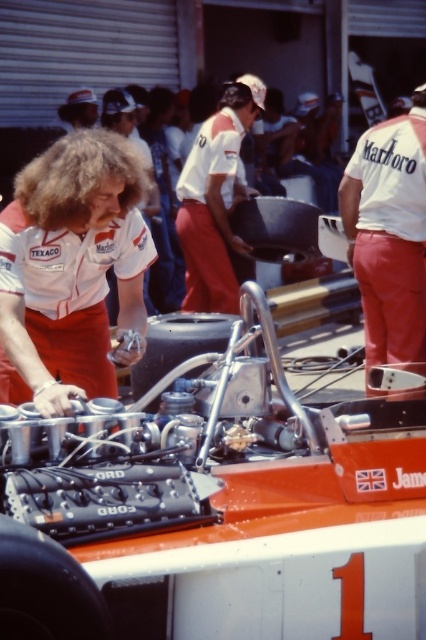
Can you confirm if white fabric marlboro shirt at center is positioned to the right of white matte shirt at center?

Correct, you'll find white fabric marlboro shirt at center to the right of white matte shirt at center.

Who is more forward, (377, 225) or (215, 276)?

Point (377, 225)

Between point (417, 243) and point (189, 161), which one is positioned in front?

Point (417, 243) is in front.

The height and width of the screenshot is (640, 426). What are the coordinates of `white fabric marlboro shirt at center` in the screenshot? It's located at [x=389, y=234].

Does orange metallic race car at center have a lesser width compared to white fabric marlboro shirt at center?

No.

Find the location of a particular element. Image resolution: width=426 pixels, height=640 pixels. orange metallic race car at center is located at coordinates (221, 506).

This screenshot has height=640, width=426. I want to click on orange metallic race car at center, so click(221, 506).

Does orange metallic race car at center have a lesser width compared to white matte shirt at center?

No.

Which is in front, point (259, 385) or point (233, 308)?

Positioned in front is point (259, 385).

At what (x,y) coordinates should I click in order to perform the action: click on orange metallic race car at center. Please return your answer as a coordinate pair (x, y). The width and height of the screenshot is (426, 640). Looking at the image, I should click on (221, 506).